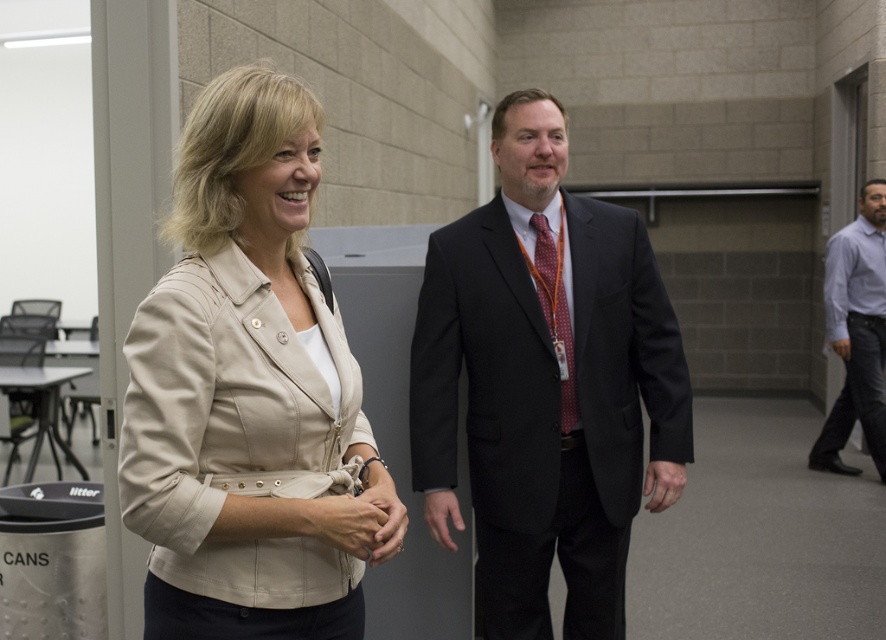
You are a photographer standing at the camera position. You want to take a closeup shot of the beige fabric jacket at center. Is the jacket within your camera range of 5 feet?

The beige fabric jacket at center is 4.31 feet away from the camera, which is within the 5 feet range. Therefore, the jacket is within the camera range.

You are a tailor who needs to determine which garment has a longer length between the beige fabric jacket at center and the light blue shirt at right. Based on the image, which one is longer?

The light blue shirt at right is longer than the beige fabric jacket at center according to the description.